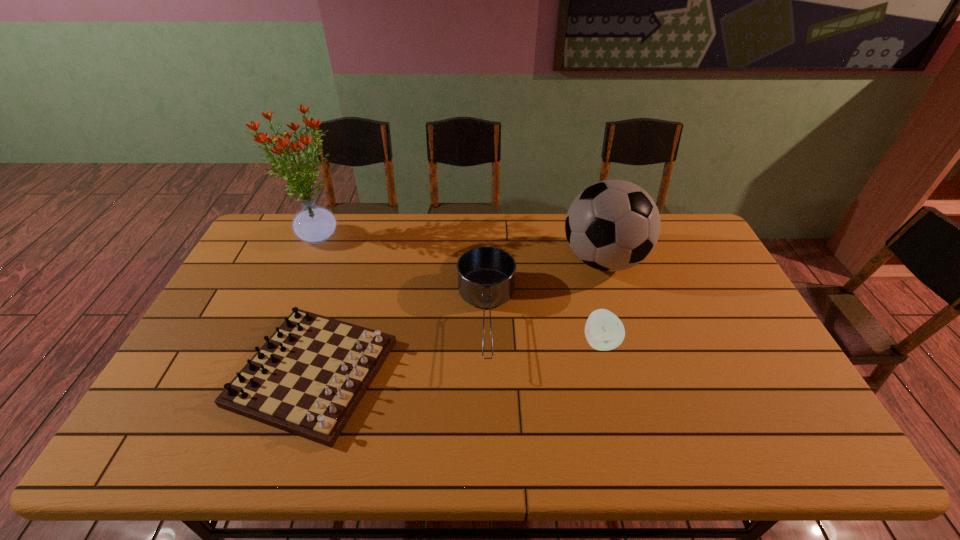
At what (x,y) coordinates should I click in order to perform the action: click on flower arrangement located in the far edge section of the desktop. Please return your answer as a coordinate pair (x, y). Looking at the image, I should click on (313, 224).

You are a GUI agent. You are given a task and a screenshot of the screen. Output one action in this format:
    pyautogui.click(x=<x>, y=<y>)
    Task: Click on the soccer ball situated at the far edge
    
    Given the screenshot: What is the action you would take?
    pyautogui.click(x=612, y=225)

Identify the location of object situated at the near edge. This screenshot has height=540, width=960. (308, 378).

Identify the location of flower arrangement positioned at the left edge. The image size is (960, 540). (313, 224).

This screenshot has height=540, width=960. What are the coordinates of `chessboard at the left edge` in the screenshot? It's located at 308,378.

I want to click on object present at the far left corner, so click(313, 224).

Where is `object that is at the near left corner`? Image resolution: width=960 pixels, height=540 pixels. object that is at the near left corner is located at coordinates (308, 378).

Where is `vacant region at the far edge of the desktop`? The height and width of the screenshot is (540, 960). vacant region at the far edge of the desktop is located at coordinates (417, 239).

This screenshot has height=540, width=960. I want to click on free space at the near edge, so click(445, 460).

This screenshot has width=960, height=540. Find the location of `free space at the left edge of the desktop`. free space at the left edge of the desktop is located at coordinates 189,368.